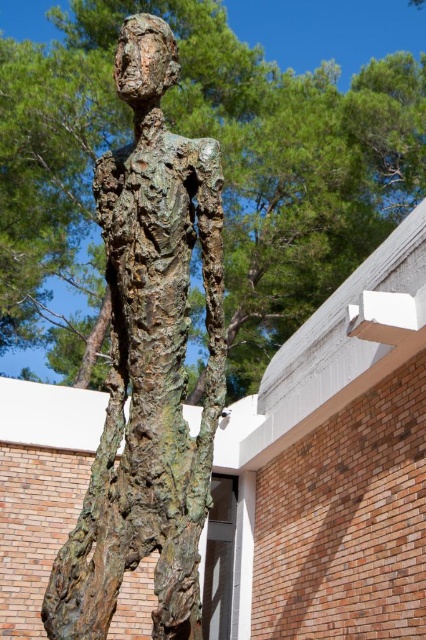
Question: Among these points, which one is farthest from the camera?

Choices:
 (A) (176, 545)
 (B) (416, 49)

Answer: (B)

Question: Is rusty bronze figure at center positioned before green textured tree at center?

Choices:
 (A) no
 (B) yes

Answer: (B)

Question: Is rusty bronze figure at center above green textured tree at center?

Choices:
 (A) yes
 (B) no

Answer: (B)

Question: Which of the following is the closest to the observer?

Choices:
 (A) (299, 13)
 (B) (184, 289)

Answer: (B)

Question: Which point is farther to the camera?

Choices:
 (A) (58, 298)
 (B) (192, 205)

Answer: (A)

Question: Is rusty bronze figure at center behind green textured tree at center?

Choices:
 (A) no
 (B) yes

Answer: (A)